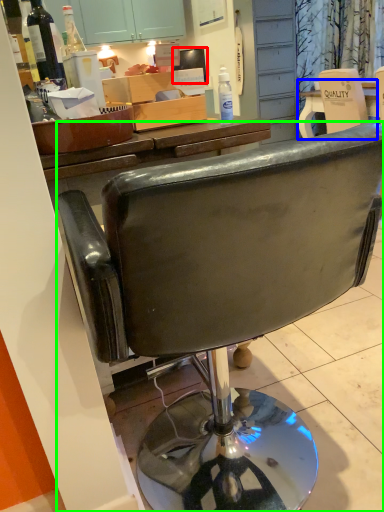
Question: Which object is the farthest from television (highlighted by a red box)? Choose among these: desk (highlighted by a blue box) or chair (highlighted by a green box).

Choices:
 (A) desk
 (B) chair

Answer: (A)